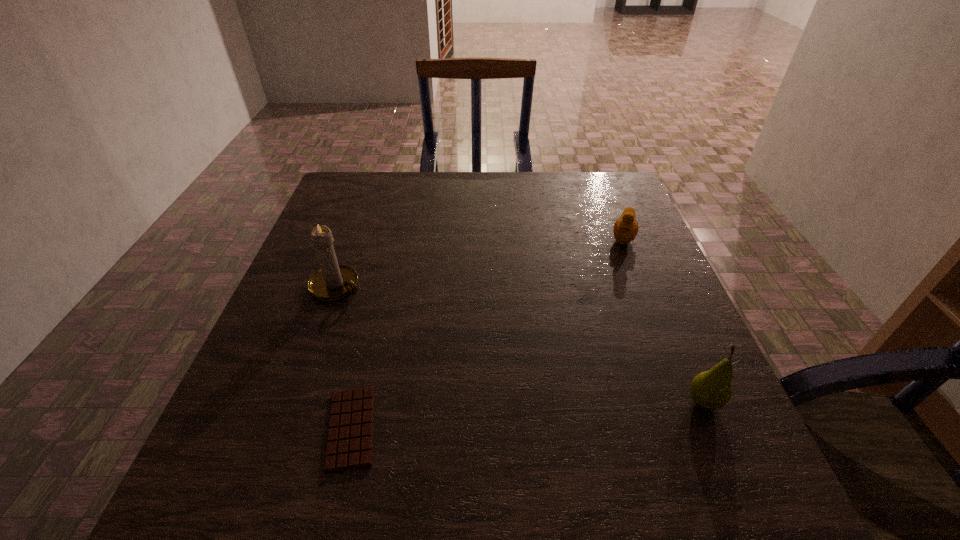
The width and height of the screenshot is (960, 540). Find the location of `free space between the third object from right to left and the duckling`. free space between the third object from right to left and the duckling is located at coordinates (487, 332).

The image size is (960, 540). What are the coordinates of `vacant area that lies between the candle holder and the second shortest object` in the screenshot? It's located at (480, 261).

Where is `free spot between the third shortest object and the third nearest object`? Image resolution: width=960 pixels, height=540 pixels. free spot between the third shortest object and the third nearest object is located at coordinates (520, 344).

You are a GUI agent. You are given a task and a screenshot of the screen. Output one action in this format:
    pyautogui.click(x=<x>, y=<y>)
    Task: Click on the vacant space in between the leftmost object and the duckling
    
    Given the screenshot: What is the action you would take?
    pyautogui.click(x=480, y=261)

The height and width of the screenshot is (540, 960). I want to click on free space between the third object from right to left and the second tallest object, so click(x=527, y=415).

Locate an element on the screen. This screenshot has width=960, height=540. free space between the third shortest object and the third tallest object is located at coordinates (663, 319).

I want to click on object that ranks as the second closest to the pear, so click(349, 445).

In order to click on the closest object to the duckling in this screenshot , I will do `click(711, 390)`.

This screenshot has height=540, width=960. I want to click on free spot that satisfies the following two spatial constraints: 1. on the front side of the leftmost object; 2. on the left side of the candy bar, so click(x=286, y=428).

You are a GUI agent. You are given a task and a screenshot of the screen. Output one action in this format:
    pyautogui.click(x=<x>, y=<y>)
    Task: Click on the free space that satisfies the following two spatial constraints: 1. on the front side of the pear; 2. on the right side of the third nearest object
    
    Given the screenshot: What is the action you would take?
    pyautogui.click(x=295, y=402)